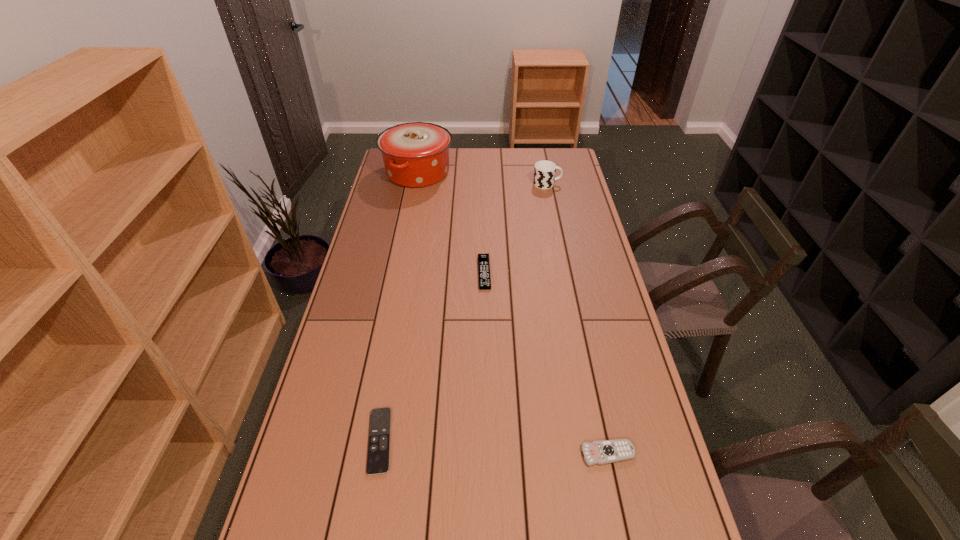
Where is `vacant area that lies between the farthest remote control and the rightmost remote control`? vacant area that lies between the farthest remote control and the rightmost remote control is located at coordinates (546, 363).

Find the location of a particular element. free space that is in between the cup and the rightmost remote control is located at coordinates coord(578,319).

Identify the location of vacant area that lies between the shortest remote control and the second remote control from right to left. (432, 356).

Locate an element on the screen. The image size is (960, 540). unoccupied position between the shortest remote control and the cup is located at coordinates (464, 312).

Locate an element on the screen. This screenshot has height=540, width=960. empty location between the rightmost remote control and the farthest remote control is located at coordinates (546, 363).

Locate an element on the screen. The width and height of the screenshot is (960, 540). free space between the cup and the second remote control from right to left is located at coordinates (516, 228).

At what (x,y) coordinates should I click in order to perform the action: click on vacant area that lies between the farthest remote control and the rightmost remote control. Please return your answer as a coordinate pair (x, y). This screenshot has height=540, width=960. Looking at the image, I should click on (546, 363).

This screenshot has width=960, height=540. Find the location of `free space between the second remote control from left to right and the rightmost remote control`. free space between the second remote control from left to right and the rightmost remote control is located at coordinates (546, 363).

This screenshot has width=960, height=540. In order to click on free area in between the cup and the leftmost remote control in this screenshot , I will do `click(464, 312)`.

Locate an element on the screen. free space between the leftmost remote control and the rightmost remote control is located at coordinates (494, 447).